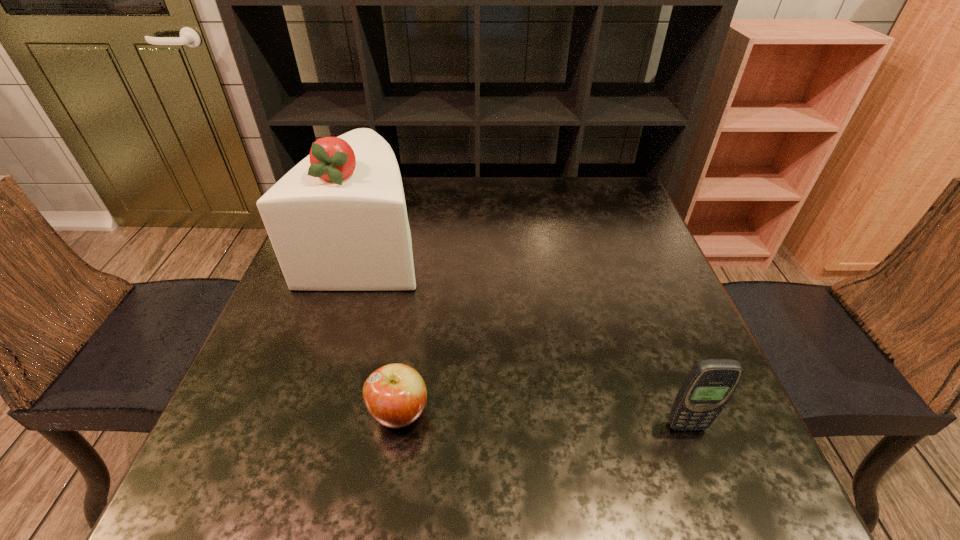
Where is `free space in the image that satisfies the following two spatial constraints: 1. on the front side of the farthest object; 2. on the left side of the apple`? This screenshot has width=960, height=540. free space in the image that satisfies the following two spatial constraints: 1. on the front side of the farthest object; 2. on the left side of the apple is located at coordinates (315, 413).